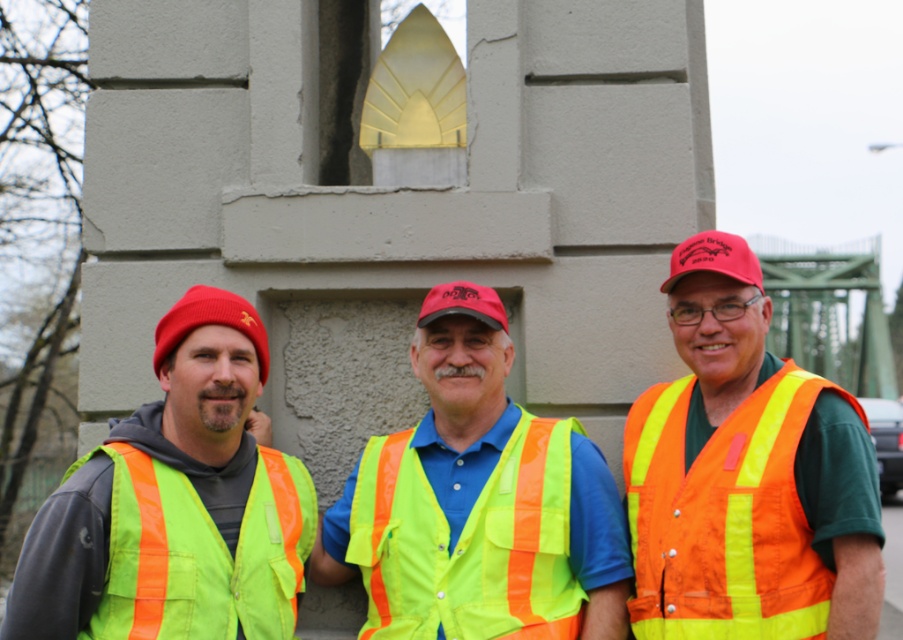
You are standing in front of the concrete structure and want to determine the relative positions of two points marked in the scene. Which point is closer to you, point (70, 468) or point (761, 282)?

Point (70, 468) is closer to you because it is further to the viewer than point (761, 282).

You are a safety inspector reviewing the image of the construction site. You need to determine if the workers are following the safety protocol which requires the safety vests to be visible. According to the image, is the matte green safety vest at center overlapping the neon green reflective safety vest at left? If so, does this violate the safety protocol that mandates that the safety vest must be fully visible at all times?

The matte green safety vest at center is positioned over the neon green reflective safety vest at left. This means the neon green reflective safety vest at left is partially or completely hidden by the matte green safety vest at center, which violates the safety protocol requiring the safety vest to be fully visible at all times.